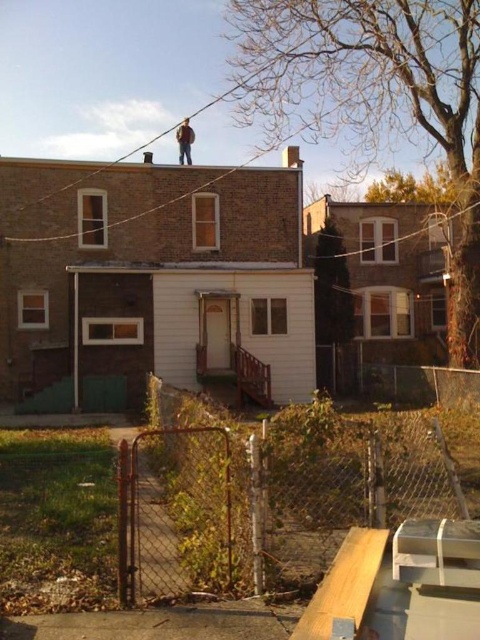
Who is higher up, rusty chain-link fence at lower center or black wire at upper center?

Positioned higher is black wire at upper center.

Is rusty chain-link fence at lower center smaller than black wire at upper center?

Correct, rusty chain-link fence at lower center occupies less space than black wire at upper center.

What do you see at coordinates (264, 506) in the screenshot? I see `rusty chain-link fence at lower center` at bounding box center [264, 506].

The height and width of the screenshot is (640, 480). I want to click on rusty chain-link fence at lower center, so click(264, 506).

Measure the distance between point (141, 486) and camera.

Point (141, 486) and camera are 33.38 feet apart.

Who is taller, rusty chain-link fence at lower center or brown leather jacket at upper center?

With more height is brown leather jacket at upper center.

Does point (325, 532) come closer to viewer compared to point (183, 152)?

Yes, it is in front of point (183, 152).

Identify the location of rusty chain-link fence at lower center. This screenshot has width=480, height=640. (264, 506).

Who is more distant from viewer, (476, 204) or (176, 132)?

The point (176, 132) is more distant.

Between black wire at upper center and brown leather jacket at upper center, which one has less height?

With less height is black wire at upper center.

You are a GUI agent. You are given a task and a screenshot of the screen. Output one action in this format:
    pyautogui.click(x=<x>, y=<y>)
    Task: Click on the black wire at upper center
    Image resolution: width=480 pixels, height=640 pixels.
    Given the screenshot: What is the action you would take?
    pyautogui.click(x=408, y=234)